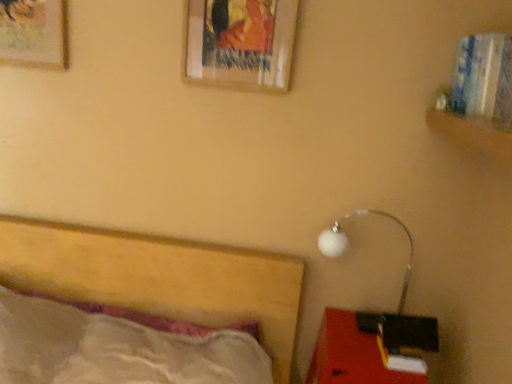
Question: Is wooden picture frame at upper center, which is the 1th picture frame from right to left, bigger than matte red desk at lower right?

Choices:
 (A) no
 (B) yes

Answer: (A)

Question: Can you confirm if wooden picture frame at upper center, which is the 1th picture frame from right to left, is thinner than matte red desk at lower right?

Choices:
 (A) yes
 (B) no

Answer: (A)

Question: Is wooden picture frame at upper center, positioned as the second picture frame in left-to-right order, facing away from matte red desk at lower right?

Choices:
 (A) yes
 (B) no

Answer: (B)

Question: Can you confirm if wooden picture frame at upper center, which is the 1th picture frame from right to left, is wider than matte red desk at lower right?

Choices:
 (A) yes
 (B) no

Answer: (B)

Question: From the image's perspective, would you say wooden picture frame at upper center, positioned as the second picture frame in left-to-right order, is positioned over matte red desk at lower right?

Choices:
 (A) yes
 (B) no

Answer: (A)

Question: From their relative heights in the image, would you say wooden picture frame at upper left, the second picture frame viewed from the right, is taller or shorter than wooden picture frame at upper center, positioned as the second picture frame in left-to-right order?

Choices:
 (A) short
 (B) tall

Answer: (A)

Question: From the image's perspective, relative to wooden picture frame at upper center, positioned as the second picture frame in left-to-right order, is wooden picture frame at upper left, the second picture frame viewed from the right, above or below?

Choices:
 (A) above
 (B) below

Answer: (A)

Question: From a real-world perspective, relative to wooden picture frame at upper center, which is the 1th picture frame from right to left, is wooden picture frame at upper left, the first picture frame viewed from the left, vertically above or below?

Choices:
 (A) above
 (B) below

Answer: (B)

Question: Considering the positions of wooden picture frame at upper left, the first picture frame viewed from the left, and wooden picture frame at upper center, positioned as the second picture frame in left-to-right order, in the image, is wooden picture frame at upper left, the first picture frame viewed from the left, bigger or smaller than wooden picture frame at upper center, positioned as the second picture frame in left-to-right order,?

Choices:
 (A) small
 (B) big

Answer: (A)

Question: Visually, is matte red desk at lower right positioned to the left or to the right of white glossy lamp at lower right?

Choices:
 (A) right
 (B) left

Answer: (B)

Question: Based on their sizes in the image, would you say matte red desk at lower right is bigger or smaller than white glossy lamp at lower right?

Choices:
 (A) big
 (B) small

Answer: (A)

Question: From the image's perspective, relative to white glossy lamp at lower right, is matte red desk at lower right above or below?

Choices:
 (A) below
 (B) above

Answer: (A)

Question: Is matte red desk at lower right inside or outside of white glossy lamp at lower right?

Choices:
 (A) inside
 (B) outside

Answer: (B)

Question: Considering the positions of white glossy lamp at lower right and wooden picture frame at upper left, the first picture frame viewed from the left, in the image, is white glossy lamp at lower right bigger or smaller than wooden picture frame at upper left, the first picture frame viewed from the left,?

Choices:
 (A) big
 (B) small

Answer: (A)

Question: Is white glossy lamp at lower right in front of or behind wooden picture frame at upper left, the second picture frame viewed from the right, in the image?

Choices:
 (A) front
 (B) behind

Answer: (A)